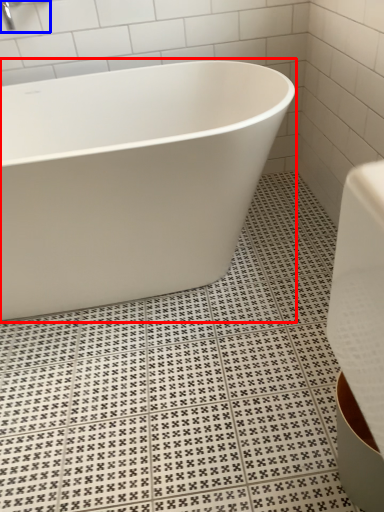
Question: Which of the following is the closest to the observer, bathtub (highlighted by a red box) or faucet (highlighted by a blue box)?

Choices:
 (A) bathtub
 (B) faucet

Answer: (A)